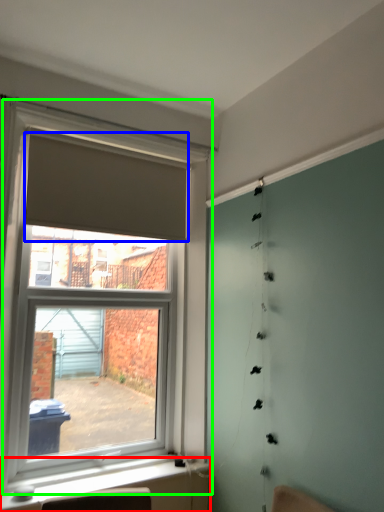
Question: Which object is positioned farthest from window sill (highlighted by a red box)? Select from curtain (highlighted by a blue box) and window (highlighted by a green box).

Choices:
 (A) curtain
 (B) window

Answer: (A)